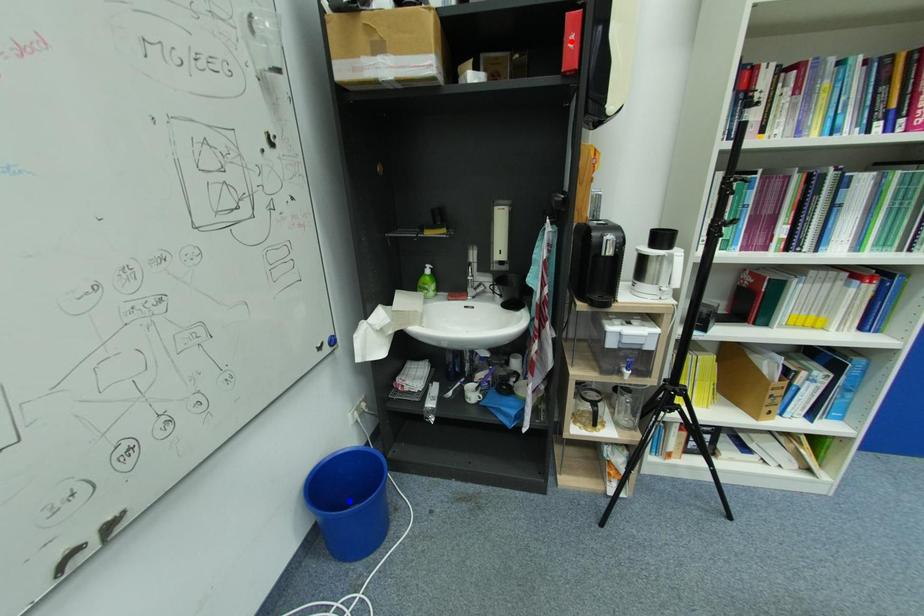
Question: Which of the two points in the image is closer to the camera?

Choices:
 (A) Blue point is closer.
 (B) Red point is closer.

Answer: (B)